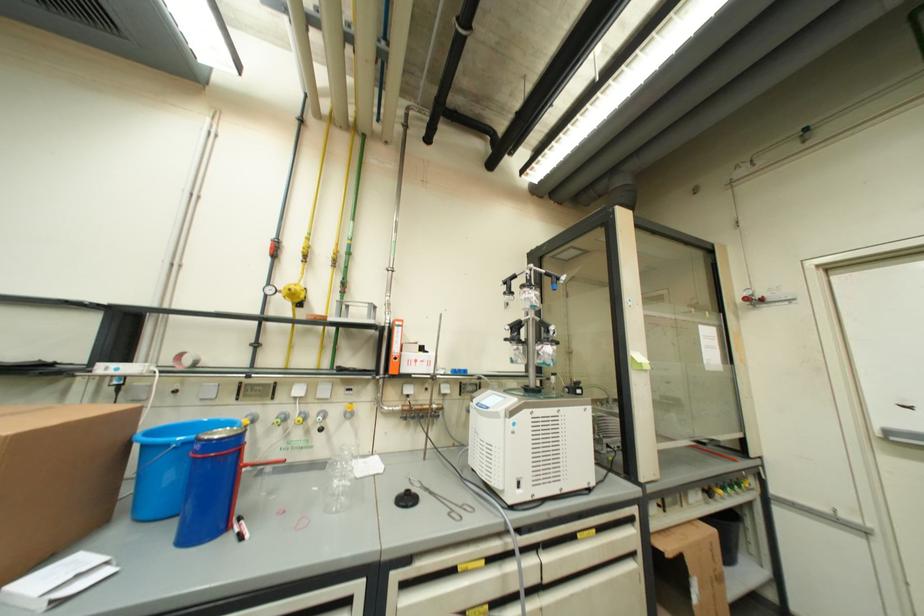
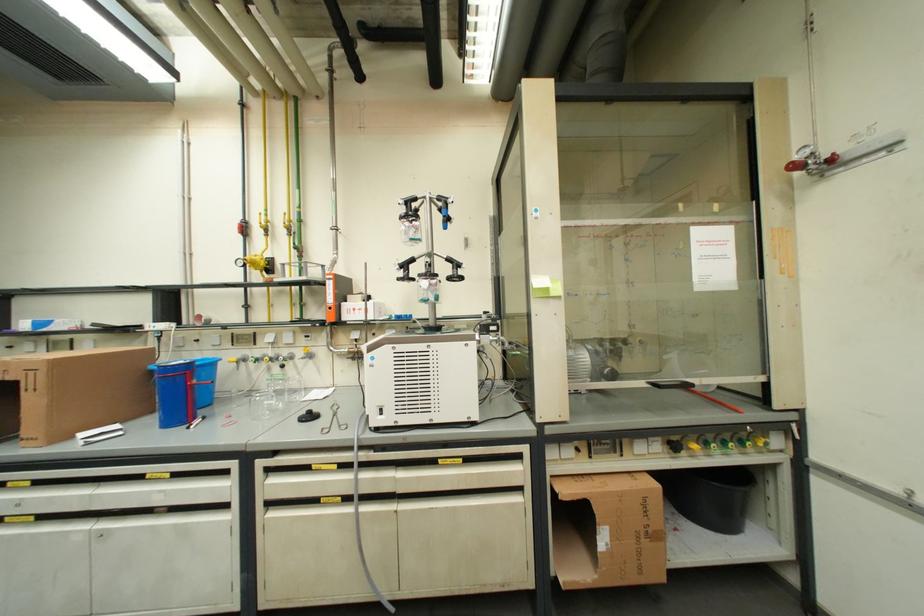
Question: The camera is either moving clockwise (left) or counter-clockwise (right) around the object. The first image is from the beginning of the video and the second image is from the end. Is the camera moving left or right when shooting the video?

Choices:
 (A) Left
 (B) Right

Answer: (B)